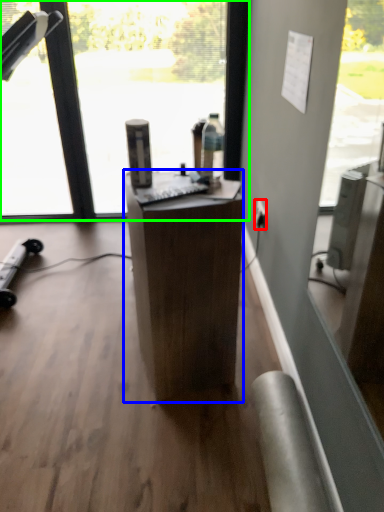
Question: Considering the real-world distances, which object is closest to power outlet (highlighted by a red box)? desk (highlighted by a blue box) or window (highlighted by a green box).

Choices:
 (A) desk
 (B) window

Answer: (A)